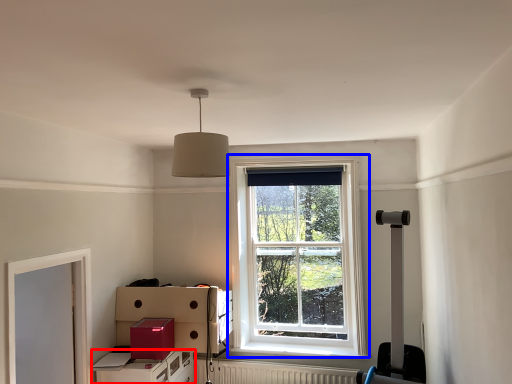
Question: Which point is further to the camera, file cabinet (highlighted by a red box) or window (highlighted by a blue box)?

Choices:
 (A) file cabinet
 (B) window

Answer: (B)